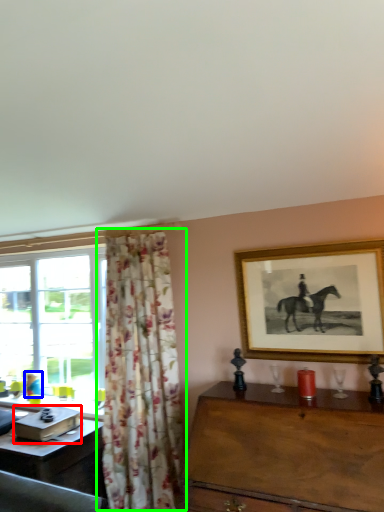
Question: Which object is the closest to the box (highlighted by a red box)? Choose among these: person (highlighted by a blue box) or curtain (highlighted by a green box).

Choices:
 (A) person
 (B) curtain

Answer: (B)